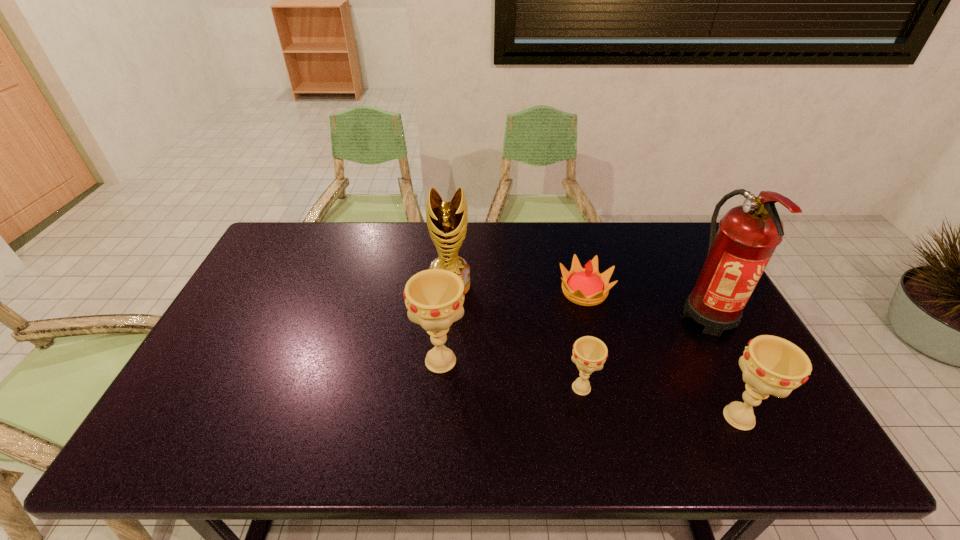
Observe the arrangement of all chalices in the image. To keep them evenly spaced, where would you place another chalice on the left? Please locate a free space. Please provide its 2D coordinates. Your answer should be formatted as a tuple, i.e. [(x, y)], where the tuple contains the x and y coordinates of a point satisfying the conditions above.

[(314, 338)]